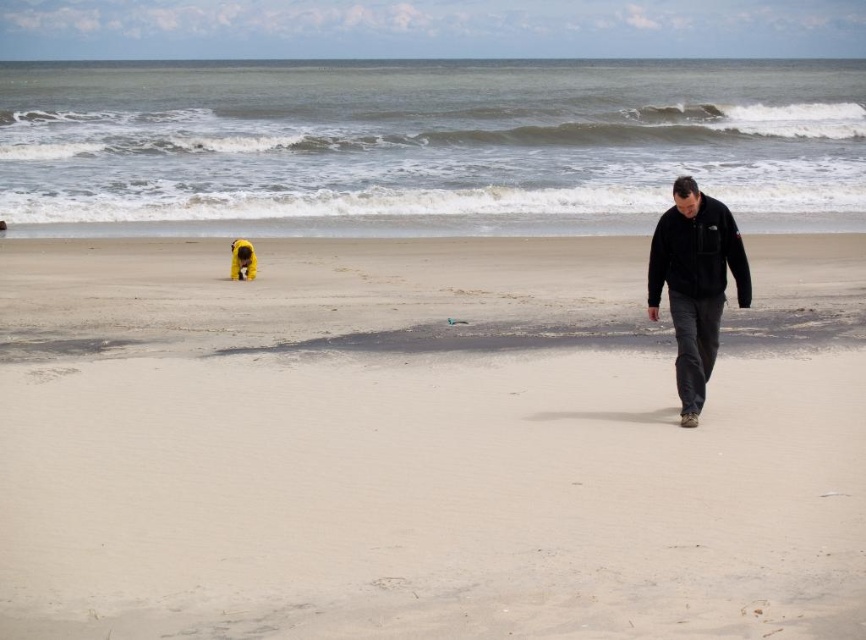
You are standing on the beach and see the smooth sand at center and the yellow fur dog at left. Which object takes up more space in the image?

The smooth sand at center takes up more space in the image because it is larger in size than the yellow fur dog at left.

You are standing on the beach and see the black fleece jacket at right and the yellow fur dog at left. Which object is nearer to you?

The black fleece jacket at right is closer to the viewer than the yellow fur dog at left.